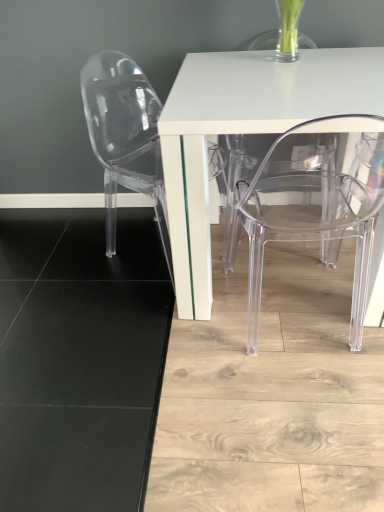
Where is `vacant area situated to the left side of transparent acrylic chair at lower right, the first chair when ordered from right to left`? vacant area situated to the left side of transparent acrylic chair at lower right, the first chair when ordered from right to left is located at coordinates (193, 352).